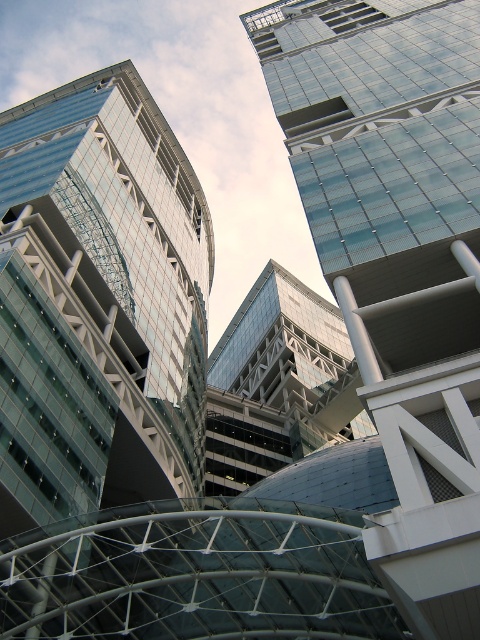
Looking at this image, does transparent glass skyscraper at upper center appear under glassy steel building at center?

No.

Between point (432, 3) and point (250, 300), which one is positioned behind?

Point (250, 300)

Locate an element on the screen. This screenshot has width=480, height=640. transparent glass skyscraper at upper center is located at coordinates (397, 259).

Looking at this image, does transparent glass skyscraper at upper center appear on the left side of transparent glass building at upper left?

Incorrect, transparent glass skyscraper at upper center is not on the left side of transparent glass building at upper left.

Find the location of `transparent glass skyscraper at upper center`. transparent glass skyscraper at upper center is located at coordinates (397, 259).

Which is in front, point (477, 616) or point (120, 192)?

Positioned in front is point (477, 616).

Locate an element on the screen. The image size is (480, 640). transparent glass skyscraper at upper center is located at coordinates (397, 259).

Does point (66, 432) come behind point (345, 326)?

That is False.

Can you confirm if transparent glass building at upper left is positioned to the right of glassy steel building at center?

No, transparent glass building at upper left is not to the right of glassy steel building at center.

Image resolution: width=480 pixels, height=640 pixels. What do you see at coordinates (98, 304) in the screenshot? I see `transparent glass building at upper left` at bounding box center [98, 304].

This screenshot has height=640, width=480. In order to click on transparent glass building at upper left in this screenshot , I will do `click(98, 304)`.